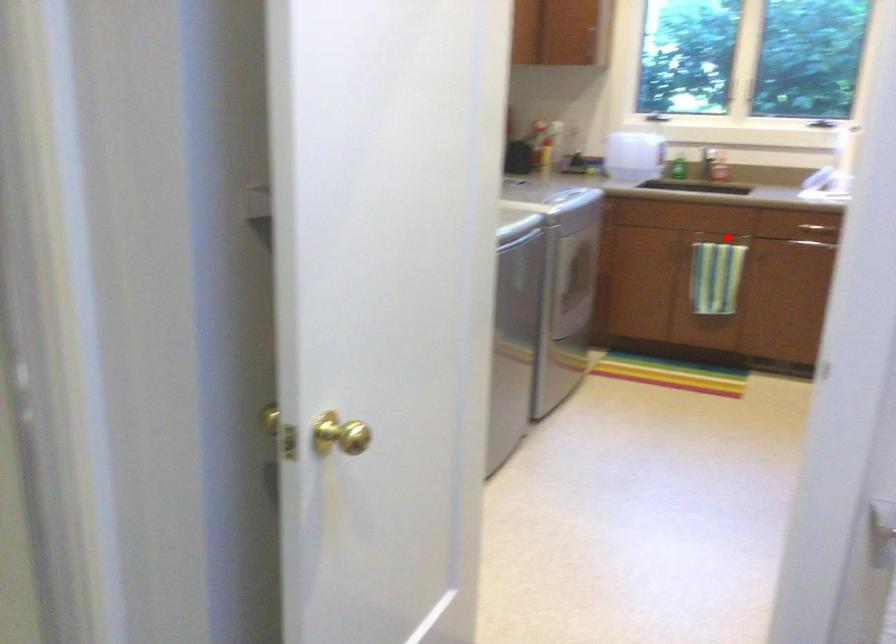
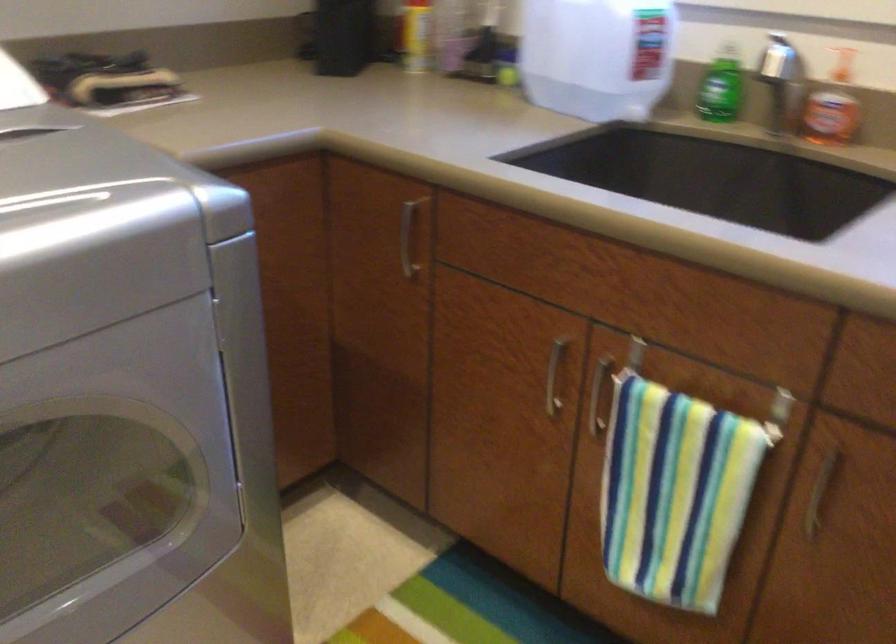
Question: I am providing you with two images of the same scene from different viewpoints. Image1 has a red point marked. In image2, the corresponding 3D location appears at what relative position? Reply with the corresponding letter.

Choices:
 (A) Closer
 (B) Farther

Answer: (A)